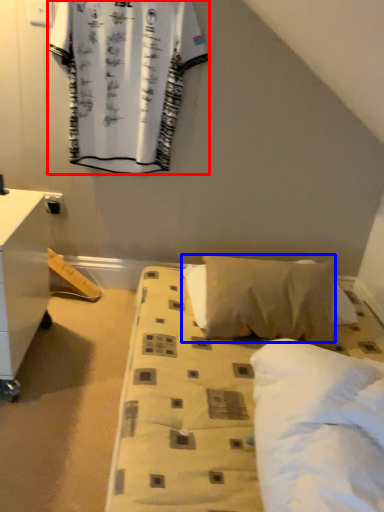
Question: Among these objects, which one is nearest to the camera, curtain (highlighted by a red box) or pillow (highlighted by a blue box)?

Choices:
 (A) curtain
 (B) pillow

Answer: (B)